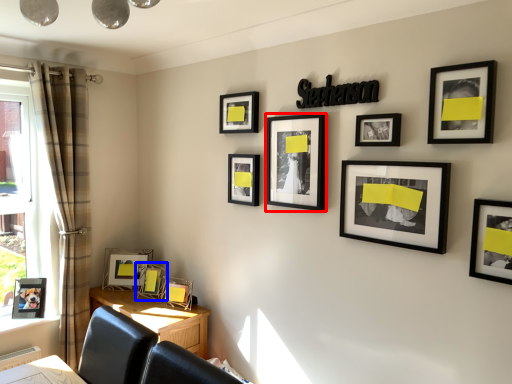
Question: Which of the following is the closest to the observer, picture frame (highlighted by a red box) or picture frame (highlighted by a blue box)?

Choices:
 (A) picture frame
 (B) picture frame

Answer: (A)